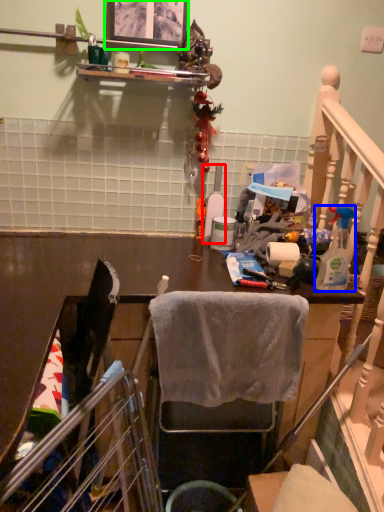
Question: Considering the real-world distances, which object is farthest from bottle (highlighted by a red box)? bottle (highlighted by a blue box) or picture frame (highlighted by a green box)?

Choices:
 (A) bottle
 (B) picture frame

Answer: (B)